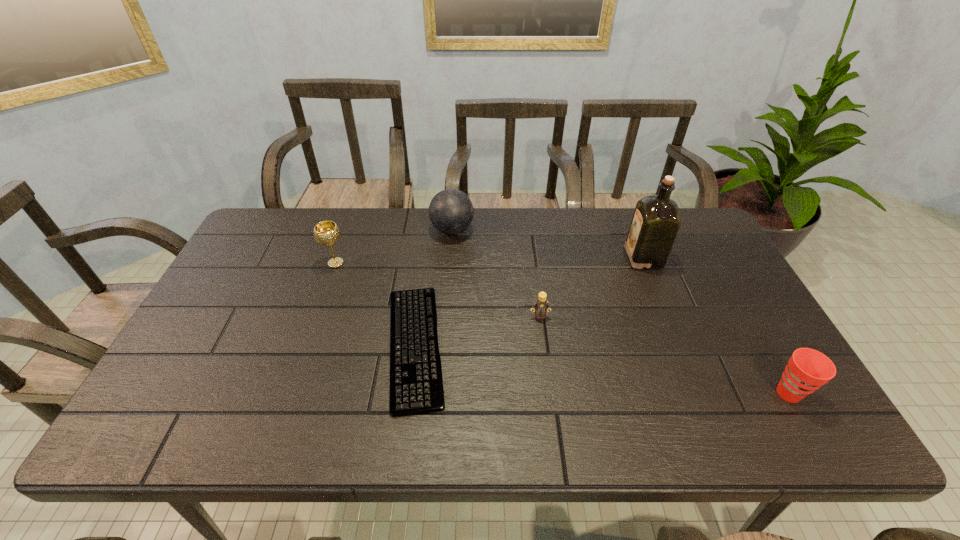
At what (x,y) coordinates should I click in order to perform the action: click on computer keyboard located in the near edge section of the desktop. Please return your answer as a coordinate pair (x, y). The width and height of the screenshot is (960, 540). Looking at the image, I should click on (416, 384).

Image resolution: width=960 pixels, height=540 pixels. Find the location of `object present at the right edge`. object present at the right edge is located at coordinates (807, 370).

I want to click on object that is at the near right corner, so tap(807, 370).

Locate an element on the screen. The height and width of the screenshot is (540, 960). free region at the far edge is located at coordinates (497, 218).

This screenshot has height=540, width=960. I want to click on vacant region at the near edge of the desktop, so click(x=690, y=435).

Image resolution: width=960 pixels, height=540 pixels. Identify the location of vacant space at the left edge of the desktop. (208, 375).

This screenshot has width=960, height=540. Find the location of `vacant point at the right edge`. vacant point at the right edge is located at coordinates (777, 365).

I want to click on vacant region at the far left corner of the desktop, so click(268, 228).

In the image, there is a desktop. Where is `free space at the near left corner`? This screenshot has height=540, width=960. free space at the near left corner is located at coordinates (204, 413).

The image size is (960, 540). What are the coordinates of `vacant area between the tallest object and the rightmost object` in the screenshot? It's located at (716, 326).